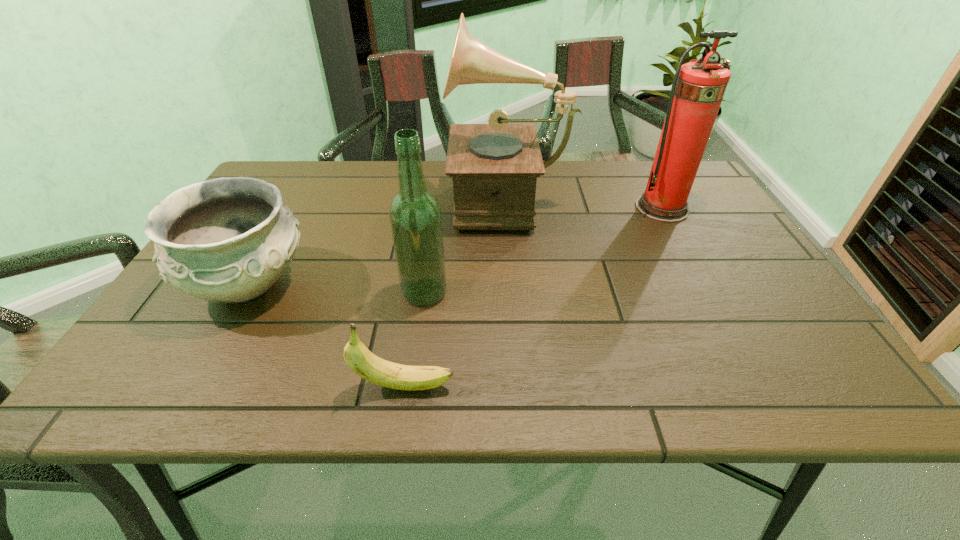
Locate an element on the screen. free space that is in between the fire extinguisher and the record player is located at coordinates (585, 202).

You are a GUI agent. You are given a task and a screenshot of the screen. Output one action in this format:
    pyautogui.click(x=<x>, y=<y>)
    Task: Click on the unoccupied area between the second shortest object and the banana
    This screenshot has height=540, width=960.
    Given the screenshot: What is the action you would take?
    pyautogui.click(x=326, y=335)

What are the coordinates of `vacant area between the fourth tallest object and the nearest object` in the screenshot? It's located at (326, 335).

Identify which object is the fourth closest to the leftmost object. Please provide its 2D coordinates. Your answer should be formatted as a tuple, i.e. [(x, y)], where the tuple contains the x and y coordinates of a point satisfying the conditions above.

[(698, 88)]

Point out which object is positioned as the nearest to the record player. Please provide its 2D coordinates. Your answer should be formatted as a tuple, i.e. [(x, y)], where the tuple contains the x and y coordinates of a point satisfying the conditions above.

[(415, 216)]

This screenshot has width=960, height=540. Identify the location of free location that satisfies the following two spatial constraints: 1. on the horn of the record player; 2. on the front side of the liquor. (516, 293).

The width and height of the screenshot is (960, 540). Identify the location of vacant space that satisfies the following two spatial constraints: 1. on the horn of the record player; 2. on the front side of the liquor. (516, 293).